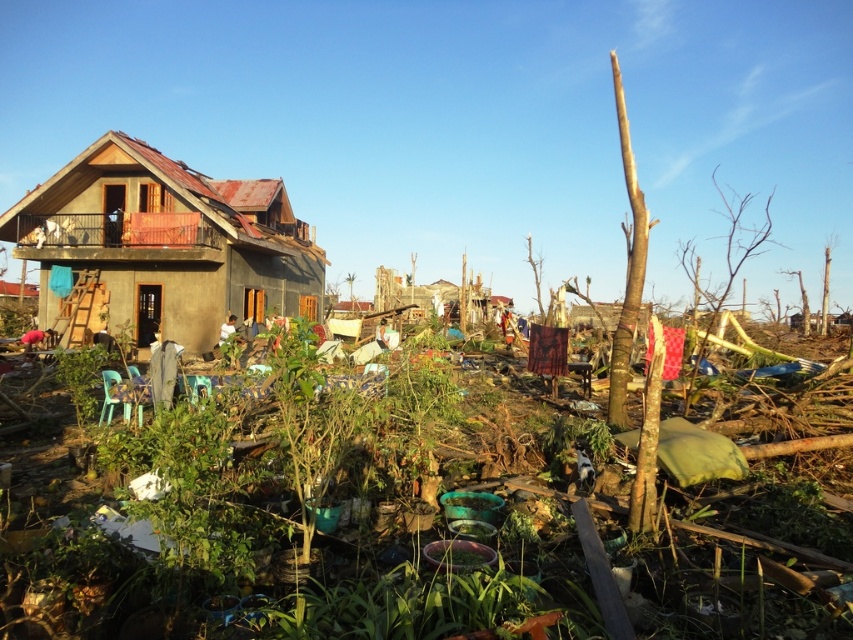
Question: Which object is farther from the camera taking this photo?

Choices:
 (A) brown wooden debris at center
 (B) matte brown house at left

Answer: (B)

Question: Can you confirm if brown wooden debris at center is smaller than matte brown house at left?

Choices:
 (A) yes
 (B) no

Answer: (A)

Question: Which object appears closest to the camera in this image?

Choices:
 (A) brown wooden debris at center
 (B) matte brown house at left

Answer: (A)

Question: Is brown wooden debris at center thinner than matte brown house at left?

Choices:
 (A) no
 (B) yes

Answer: (B)

Question: Does brown wooden debris at center appear over matte brown house at left?

Choices:
 (A) no
 (B) yes

Answer: (A)